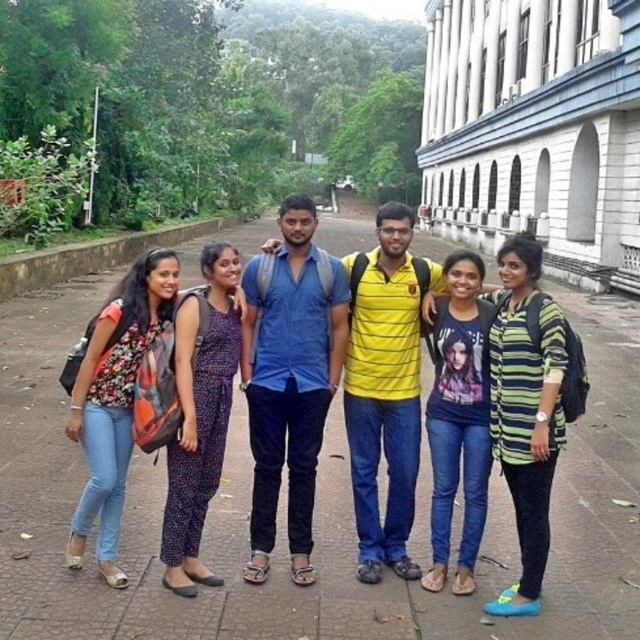
Question: Estimate the real-world distances between objects in this image. Which object is farther from the green striped shirt at center?

Choices:
 (A) floral print shirt at left
 (B) purple dotted jumpsuit at center

Answer: (A)

Question: Is blue denim shirt at center below purple dotted jumpsuit at center?

Choices:
 (A) yes
 (B) no

Answer: (B)

Question: Which of the following is the farthest from the observer?

Choices:
 (A) floral print shirt at left
 (B) green striped shirt at center
 (C) purple dotted jumpsuit at center

Answer: (A)

Question: Based on their relative distances, which object is farther from the floral print shirt at left?

Choices:
 (A) printed cotton t-shirt at center
 (B) purple dotted jumpsuit at center
 (C) matte black backpack at center

Answer: (A)

Question: Observing the image, what is the correct spatial positioning of blue denim shirt at center in reference to purple dotted jumpsuit at center?

Choices:
 (A) below
 (B) above

Answer: (B)

Question: Is matte black backpack at center to the left of floral print shirt at left from the viewer's perspective?

Choices:
 (A) no
 (B) yes

Answer: (A)